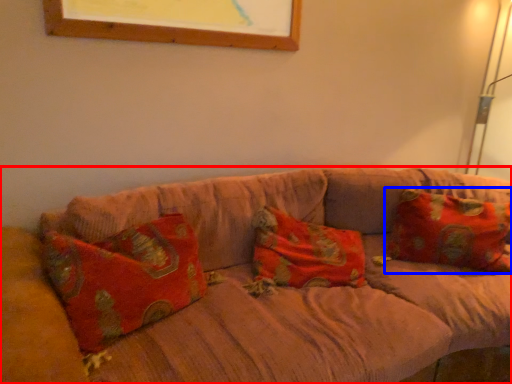
Question: Among these objects, which one is farthest to the camera, studio couch (highlighted by a red box) or pillow (highlighted by a blue box)?

Choices:
 (A) studio couch
 (B) pillow

Answer: (B)